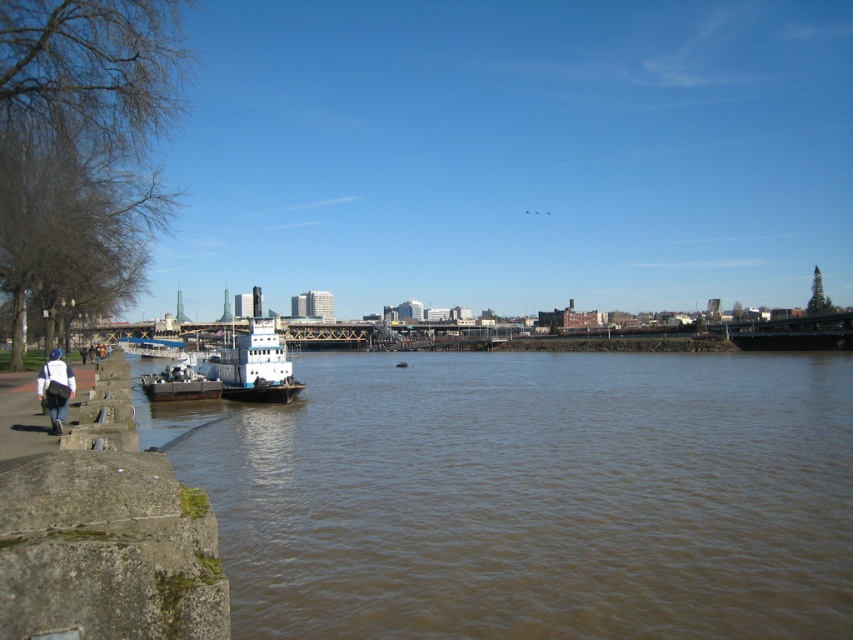
Question: Which point is closer to the camera?

Choices:
 (A) white matte jacket at lower left
 (B) matte white barge at left
 (C) brown/muddy water at lower left
 (D) white matte tugboat at center

Answer: (C)

Question: Is white matte tugboat at center to the left of white matte jacket at lower left from the viewer's perspective?

Choices:
 (A) yes
 (B) no

Answer: (A)

Question: Estimate the real-world distances between objects in this image. Which object is farther from the brown/muddy water at lower left?

Choices:
 (A) white matte tugboat at center
 (B) matte white barge at left
 (C) white matte jacket at lower left

Answer: (C)

Question: Among these objects, which one is nearest to the camera?

Choices:
 (A) white matte jacket at lower left
 (B) white matte tugboat at center
 (C) matte white barge at left

Answer: (A)

Question: Is matte white barge at left above white matte jacket at lower left?

Choices:
 (A) no
 (B) yes

Answer: (A)

Question: Can you confirm if white matte tugboat at center is wider than white matte jacket at lower left?

Choices:
 (A) yes
 (B) no

Answer: (A)